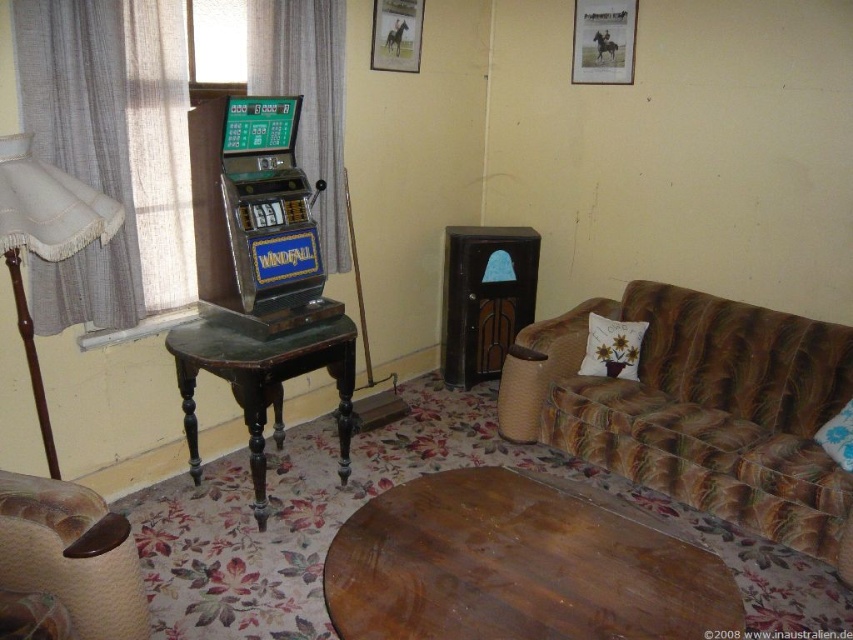
Question: Does metallic slot machine at left lie in front of leather armchair at lower left?

Choices:
 (A) yes
 (B) no

Answer: (B)

Question: Does wooden table at center have a larger size compared to metallic slot machine at left?

Choices:
 (A) no
 (B) yes

Answer: (B)

Question: Among these points, which one is farthest from the camera?

Choices:
 (A) (38, 196)
 (B) (322, 353)

Answer: (B)

Question: Among these points, which one is nearest to the camera?

Choices:
 (A) click(x=45, y=440)
 (B) click(x=283, y=301)
 (C) click(x=682, y=429)

Answer: (A)

Question: Which object is closer to the camera taking this photo?

Choices:
 (A) wooden table at center
 (B) leather armchair at lower left
 (C) beige fabric lampshade at left
 (D) black wood table at center

Answer: (A)

Question: Can you confirm if leather armchair at lower left is positioned above black wood table at center?

Choices:
 (A) yes
 (B) no

Answer: (B)